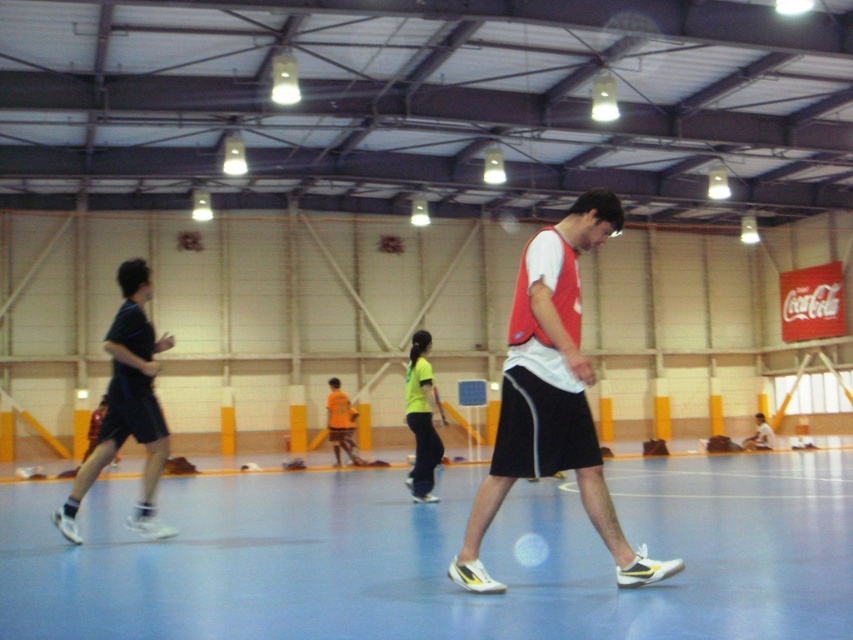
You are a referee in a sports hall and need to ensure players maintain a safe distance of at least 10 meters apart during practice. You see an orange jersey at center and a light blue fabric shirt at center. Are the players wearing these shirts maintaining the required distance?

The orange jersey at center is 10.18 meters from the light blue fabric shirt at center, so yes, the players are maintaining the required distance of at least 10 meters apart.

You are standing in the sports hall and want to place a small potted plant between the blue rubber basketball court at center and the orange jersey at center. Which object should you place the plant closer to if you want it to appear larger in the photo?

The blue rubber basketball court at center is closer to the viewer than the orange jersey at center. To make the plant appear larger in the photo, place it closer to the blue rubber basketball court at center since objects closer to the camera appear larger.

You are standing at the entrance of the sports hall and see the neon yellow jersey at center and the light blue fabric shirt at center. If you want to throw a ball to the nearest person, which one should you aim for?

The neon yellow jersey at center is 10.86 meters away from the light blue fabric shirt at center. Since the light blue fabric shirt at center is closer to you, you should aim for the light blue fabric shirt at center.